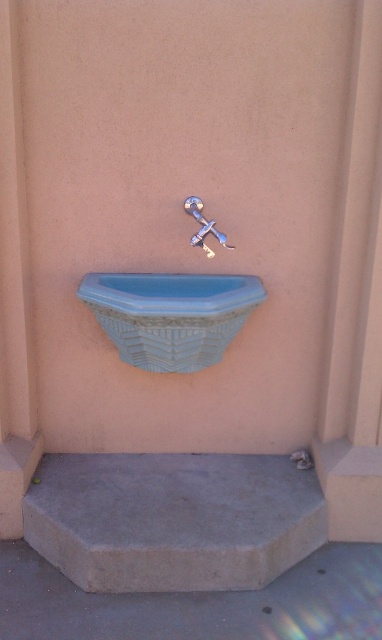
You are standing in front of a drinking fountain and want to know how far you are from the point marked at coordinates point (137, 483). Can you determine the distance?

The distance between point (137, 483) and the camera is 2.67 meters.

Looking at this image, you are a maintenance worker who needs to clean the blue ceramic sink at center and the satin nickel faucet at center. Your cleaning spray bottle can reach up to 30 centimeters. Can you clean both objects without moving your position?

The distance between the blue ceramic sink at center and the satin nickel faucet at center is 31.96 centimeters, which is beyond the spray bottle range of 30 centimeters. Therefore, you cannot clean both objects without moving your position.